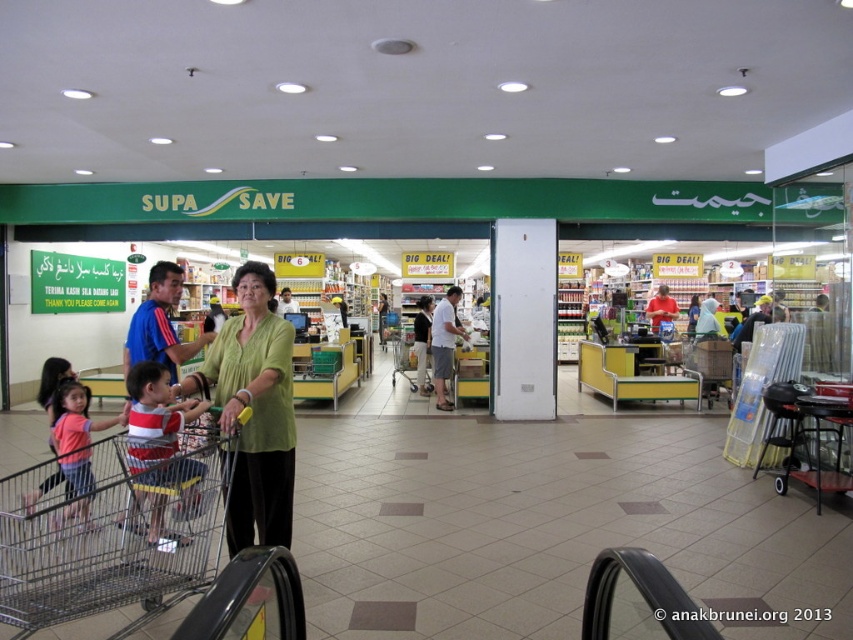
Question: Is metallic silver shopping cart at center further to camera compared to green matte shirt at center?

Choices:
 (A) no
 (B) yes

Answer: (A)

Question: Is metallic silver shopping cart at center positioned in front of striped cotton shirt at lower left?

Choices:
 (A) no
 (B) yes

Answer: (B)

Question: Among these objects, which one is nearest to the camera?

Choices:
 (A) white cotton shirt at center
 (B) pink matte shirt at lower left
 (C) green matte shirt at center
 (D) metallic silver shopping cart at center

Answer: (D)

Question: Can you confirm if striped cotton shirt at lower left is positioned below white cotton shirt at center?

Choices:
 (A) no
 (B) yes

Answer: (B)

Question: Which point is farther to the camera?

Choices:
 (A) white cotton shirt at center
 (B) pink matte shirt at lower left

Answer: (A)

Question: Considering the real-world distances, which object is farthest from the striped cotton shirt at lower left?

Choices:
 (A) pink matte shirt at lower left
 (B) white cotton shirt at center
 (C) green matte shirt at center

Answer: (B)